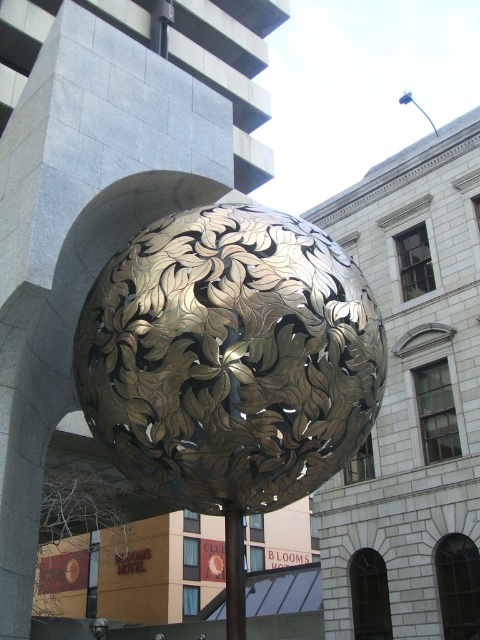
You are an architect designing a new plaza and want to place a bench between the gold metallic sphere at center and the gold metallic pole at center. The bench requires a minimum of 12 feet of space to fit. Based on the scene, is there enough space for the bench between them?

The gold metallic sphere at center is 16.31 feet from the gold metallic pole at center, so yes, there is enough space for the bench since 16.31 feet exceeds the required 12 feet.

You are an architect designing a new plaza and want to ensure the gold metallic sphere at center and the gold metallic pole at center can fit through a 2.5 meter wide doorway. Based on their sizes, will both objects fit through the doorway when moved individually?

The gold metallic sphere at center might be wider than the gold metallic pole at center. Since the sphere might have a width exceeding 2.5 meters, it may not fit through the doorway. The pole, being narrower, should fit. Therefore, the sphere might not fit, but the pole will.

You are an architect designing a new plaza and want to place a bench between the gold metallic sphere at center and the gold metallic pole at center. Since the pole is taller than the sphere, where should the bench be placed to ensure it is closer to the shorter object?

The gold metallic sphere at center is shorter than the gold metallic pole at center, so the bench should be placed closer to the gold metallic sphere at center.